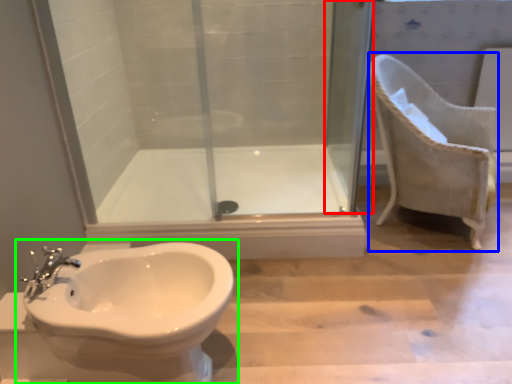
Question: Which object is the closest to the screen door (highlighted by a red box)? Choose among these: armchair (highlighted by a blue box) or toilet (highlighted by a green box).

Choices:
 (A) armchair
 (B) toilet

Answer: (A)